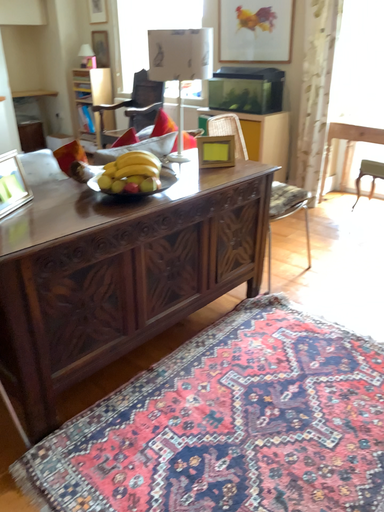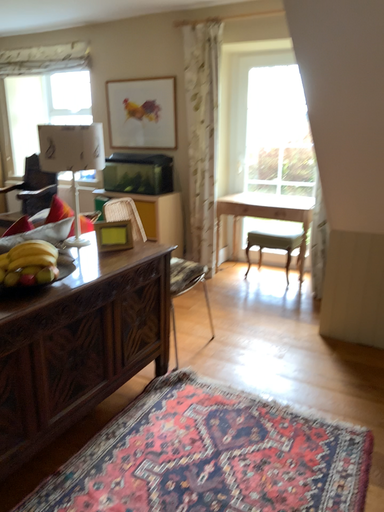
Question: Which way did the camera rotate in the video?

Choices:
 (A) rotated upward
 (B) rotated downward

Answer: (A)